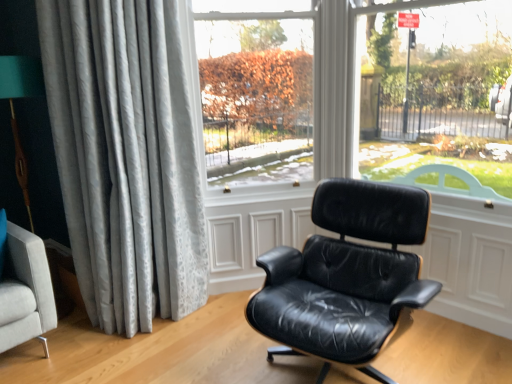
Measure the distance between transparent glass window at center and camera.

8.89 feet.

Identify the location of black leather chair at center. The width and height of the screenshot is (512, 384). (345, 274).

Which of these two, transparent glass window at center or black leather chair at center, is thinner?

Thinner between the two is transparent glass window at center.

From the image's perspective, does transparent glass window at center appear higher than black leather chair at center?

Correct, transparent glass window at center appears higher than black leather chair at center in the image.

In the image, is transparent glass window at center positioned in front of or behind black leather chair at center?

transparent glass window at center is positioned farther from the viewer than black leather chair at center.

Is black leather chair at center inside the boundaries of silvery textured curtain at left, or outside?

black leather chair at center cannot be found inside silvery textured curtain at left.

Considering the sizes of objects black leather chair at center and silvery textured curtain at left in the image provided, who is smaller, black leather chair at center or silvery textured curtain at left?

With smaller size is black leather chair at center.

In the scene shown: How different are the orientations of black leather chair at center and silvery textured curtain at left in degrees?

The angle between the facing direction of black leather chair at center and the facing direction of silvery textured curtain at left is 33.9 degrees.

Is the surface of silvery textured curtain at left in direct contact with black leather chair at center?

They are not placed beside each other.

Which of these two, silvery textured curtain at left or black leather chair at center, is bigger?

silvery textured curtain at left is bigger.

Is point (94, 57) positioned in front of point (393, 284)?

No, it is behind (393, 284).

From a real-world perspective, who is located lower, black leather chair at center or transparent glass window at center?

From a 3D spatial view, black leather chair at center is below.

Which of these two, black leather chair at center or transparent glass window at center, is wider?

With larger width is black leather chair at center.

Considering the sizes of black leather chair at center and transparent glass window at center in the image, is black leather chair at center bigger or smaller than transparent glass window at center?

Considering their sizes, black leather chair at center takes up more space than transparent glass window at center.

In order to click on window screen behind the black leather chair at center in this screenshot , I will do `click(255, 93)`.

Is silvery textured curtain at left smaller than transparent glass window at center?

No, silvery textured curtain at left is not smaller than transparent glass window at center.

Which of these two, silvery textured curtain at left or transparent glass window at center, stands taller?

silvery textured curtain at left is taller.

Is silvery textured curtain at left to the right of transparent glass window at center from the viewer's perspective?

No.

How much distance is there between silvery textured curtain at left and transparent glass window at center?

silvery textured curtain at left is 29.86 inches away from transparent glass window at center.

Which of these two, transparent glass window at center or silvery textured curtain at left, stands taller?

silvery textured curtain at left is taller.

Between transparent glass window at center and silvery textured curtain at left, which one has smaller width?

With smaller width is transparent glass window at center.

Is the surface of transparent glass window at center in direct contact with silvery textured curtain at left?

They are not placed beside each other.

Identify the location of chair below the transparent glass window at center (from the image's perspective). Image resolution: width=512 pixels, height=384 pixels. (345, 274).

The height and width of the screenshot is (384, 512). I want to click on curtain located behind the black leather chair at center, so click(x=125, y=158).

Based on their spatial positions, is transparent glass window at center or black leather chair at center further from silvery textured curtain at left?

Among the two, black leather chair at center is located further to silvery textured curtain at left.

From the picture: From the image, which object appears to be farther from silvery textured curtain at left, black leather chair at center or transparent glass window at center?

Among the two, black leather chair at center is located further to silvery textured curtain at left.

Considering their positions, is silvery textured curtain at left positioned further to black leather chair at center than transparent glass window at center?

transparent glass window at center.

Looking at the image, which one is located closer to black leather chair at center, transparent glass window at center or silvery textured curtain at left?

Among the two, silvery textured curtain at left is located nearer to black leather chair at center.

When comparing their distances from transparent glass window at center, does black leather chair at center or silvery textured curtain at left seem closer?

The object closer to transparent glass window at center is silvery textured curtain at left.

From the image, which object appears to be farther from transparent glass window at center, silvery textured curtain at left or black leather chair at center?

black leather chair at center.

Identify the location of window screen between silvery textured curtain at left and black leather chair at center. The height and width of the screenshot is (384, 512). (255, 93).